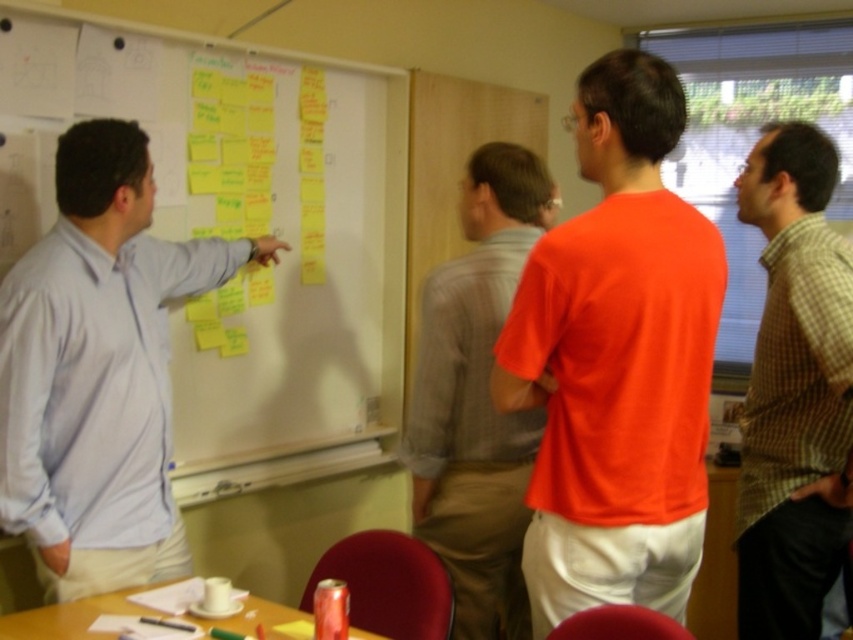
You are part of the team in the meeting. You need to hand a document to the orange matte shirt at center without blocking the yellow sticky notes at upper left. How should you approach them?

Since the orange matte shirt at center is behind the yellow sticky notes at upper left, you should approach them from the side or around the yellow sticky notes to avoid blocking the view of the sticky notes.